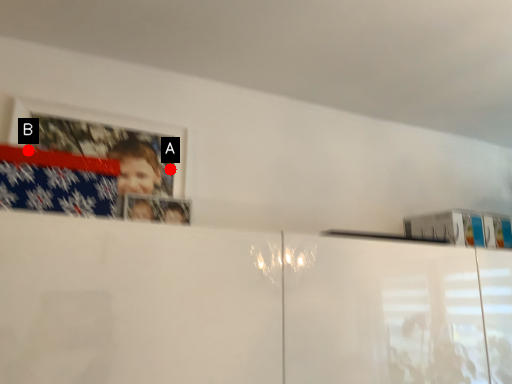
Question: Two points are circled on the image, labeled by A and B beside each circle. Among these points, which one is nearest to the camera?

Choices:
 (A) A is closer
 (B) B is closer

Answer: (B)